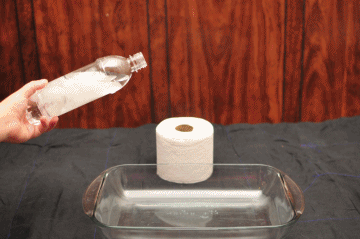
Where is `wood panel`? This screenshot has width=360, height=239. wood panel is located at coordinates (251, 58).